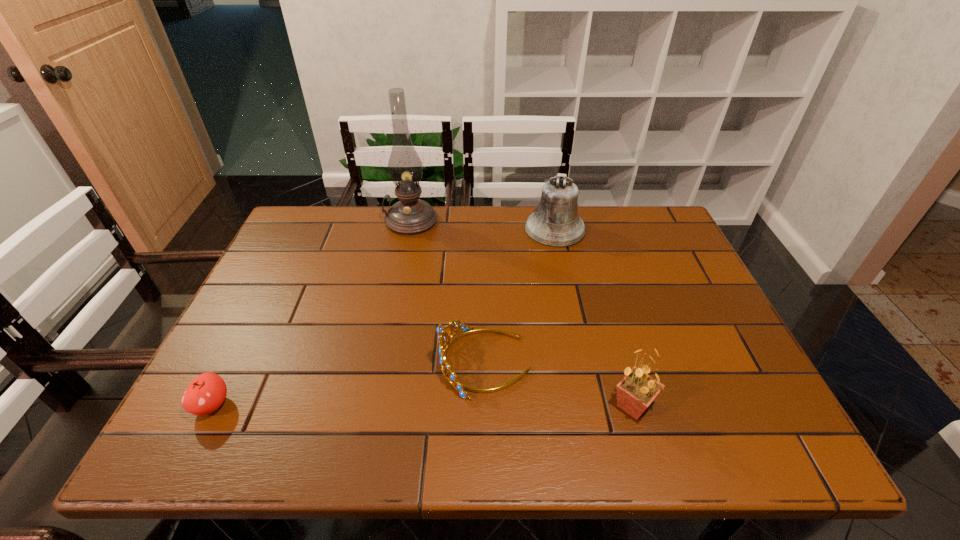
Where is `apple present at the near edge`? apple present at the near edge is located at coordinates (206, 393).

Identify the location of object that is at the left edge. The height and width of the screenshot is (540, 960). (206, 393).

This screenshot has height=540, width=960. What are the coordinates of `object that is positioned at the near left corner` in the screenshot? It's located at (206, 393).

Identify the location of vacant space at the far edge. The image size is (960, 540). (530, 249).

In the image, there is a desktop. In order to click on vacant space at the near edge in this screenshot , I will do `click(525, 443)`.

At what (x,y) coordinates should I click in order to perform the action: click on vacant space at the left edge of the desktop. Please return your answer as a coordinate pair (x, y). This screenshot has height=540, width=960. Looking at the image, I should click on (304, 285).

Locate an element on the screen. The height and width of the screenshot is (540, 960). free region at the right edge of the desktop is located at coordinates (658, 293).

In the image, there is a desktop. Find the location of `vacant space at the far left corner`. vacant space at the far left corner is located at coordinates (321, 228).

I want to click on vacant space at the near left corner, so point(188,425).

This screenshot has width=960, height=540. In the image, there is a desktop. In order to click on free space at the far right corner in this screenshot , I will do pyautogui.click(x=663, y=249).